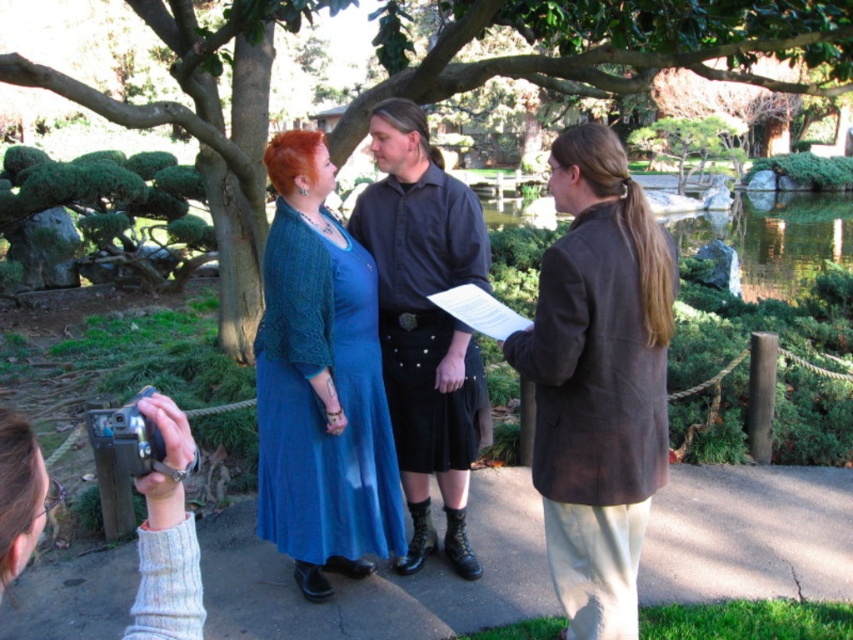
Is brown suede jacket at right closer to the viewer compared to black matte shirt at center?

Yes, brown suede jacket at right is in front of black matte shirt at center.

Based on the photo, can you confirm if brown suede jacket at right is positioned below black matte shirt at center?

Indeed, brown suede jacket at right is positioned under black matte shirt at center.

Where is `brown suede jacket at right`? The image size is (853, 640). brown suede jacket at right is located at coordinates (595, 419).

Does blue knitted dress at center appear over black matte shirt at center?

No.

Image resolution: width=853 pixels, height=640 pixels. Find the location of `blue knitted dress at center`. blue knitted dress at center is located at coordinates (320, 401).

This screenshot has width=853, height=640. I want to click on blue knitted dress at center, so tap(320, 401).

Between green leafy tree at center and blue knitted dress at center, which one has more height?

With more height is green leafy tree at center.

Which is above, green leafy tree at center or blue knitted dress at center?

green leafy tree at center is higher up.

Does point (607, 22) come in front of point (346, 248)?

No.

Locate an element on the screen. The height and width of the screenshot is (640, 853). green leafy tree at center is located at coordinates (607, 48).